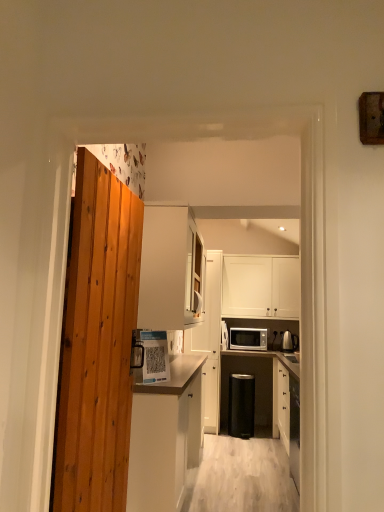
Question: Does matte white microwave at center have a greater height compared to white glossy paper at center, the third appliance positioned from the right?

Choices:
 (A) yes
 (B) no

Answer: (B)

Question: From the image's perspective, is matte white microwave at center located beneath white glossy paper at center, the first appliance viewed from the left?

Choices:
 (A) no
 (B) yes

Answer: (B)

Question: Can you confirm if matte white microwave at center is thinner than white glossy paper at center, the first appliance viewed from the left?

Choices:
 (A) no
 (B) yes

Answer: (A)

Question: Is matte white microwave at center aimed at white glossy paper at center, placed as the third appliance when sorted from bottom to top?

Choices:
 (A) yes
 (B) no

Answer: (A)

Question: Does matte white microwave at center appear on the left side of white glossy paper at center, the 3th appliance in the back-to-front sequence?

Choices:
 (A) yes
 (B) no

Answer: (B)

Question: Could white glossy paper at center, placed as the third appliance when sorted from bottom to top, be considered to be inside matte white microwave at center?

Choices:
 (A) yes
 (B) no

Answer: (B)

Question: From the image's perspective, would you say metallic silver kettle at right, which is the second appliance from bottom to top, is shown under white matte cabinet at upper center, which is the second cabinetry in right-to-left order?

Choices:
 (A) no
 (B) yes

Answer: (B)

Question: Can you confirm if metallic silver kettle at right, the second appliance in the top-to-bottom sequence, is bigger than white matte cabinet at upper center, which is the second cabinetry in right-to-left order?

Choices:
 (A) yes
 (B) no

Answer: (B)

Question: From a real-world perspective, is metallic silver kettle at right, the third appliance from the front, located beneath white matte cabinet at upper center, the third cabinetry from the left?

Choices:
 (A) no
 (B) yes

Answer: (B)

Question: Is metallic silver kettle at right, which is the second appliance from bottom to top, positioned before white matte cabinet at upper center, the third cabinetry from the left?

Choices:
 (A) no
 (B) yes

Answer: (A)

Question: Could you tell me if metallic silver kettle at right, which is the second appliance from bottom to top, is facing white matte cabinet at upper center, the third cabinetry from the left?

Choices:
 (A) no
 (B) yes

Answer: (A)

Question: Is metallic silver kettle at right, which is the second appliance from bottom to top, wider than white matte cabinet at upper center, the third cabinetry from the left?

Choices:
 (A) yes
 (B) no

Answer: (B)

Question: Considering the relative sizes of white matte cabinet at upper center, the third cabinetry positioned from the right, and white matte cabinet at center, acting as the first cabinetry starting from the left, in the image provided, is white matte cabinet at upper center, the third cabinetry positioned from the right, wider than white matte cabinet at center, acting as the first cabinetry starting from the left,?

Choices:
 (A) yes
 (B) no

Answer: (A)